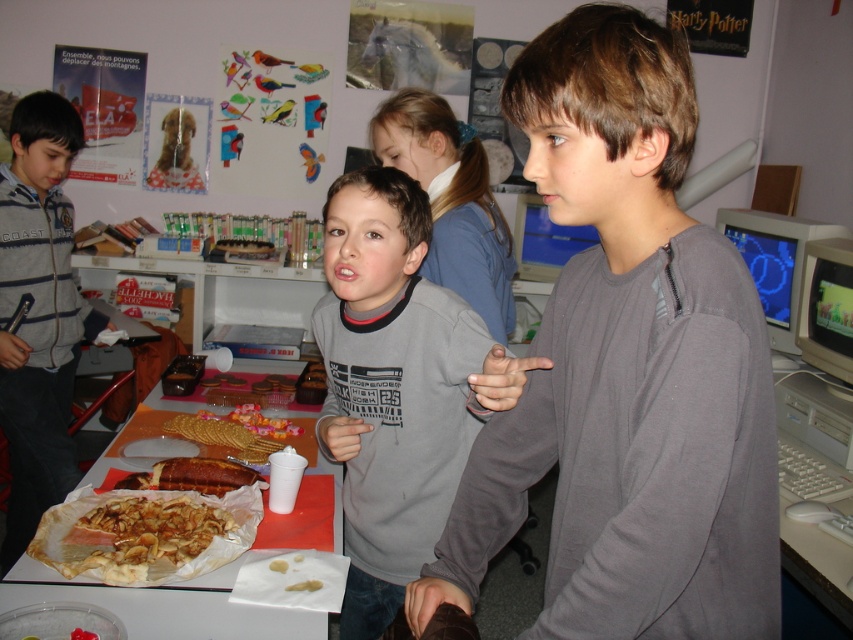
Is point (582, 493) behind point (160, 412)?

No, (582, 493) is in front of (160, 412).

Does gray zip-up sweatshirt at center have a greater height compared to white paper plate at center?

Yes, gray zip-up sweatshirt at center is taller than white paper plate at center.

Locate an element on the screen. Image resolution: width=853 pixels, height=640 pixels. gray zip-up sweatshirt at center is located at coordinates (627, 369).

In the scene shown: Does striped fleece jacket at left lie behind pink sugary cookies at center?

Yes, it is.

Who is positioned more to the left, striped fleece jacket at left or pink sugary cookies at center?

From the viewer's perspective, striped fleece jacket at left appears more on the left side.

Does point (27, 193) come closer to viewer compared to point (305, 440)?

No, it is not.

This screenshot has height=640, width=853. In order to click on striped fleece jacket at left in this screenshot , I will do `click(38, 312)`.

Who is positioned more to the left, gray zip-up sweatshirt at center or matte plastic tray at center?

matte plastic tray at center

Does gray zip-up sweatshirt at center come behind matte plastic tray at center?

That is False.

Is point (648, 520) closer to camera compared to point (254, 252)?

Yes, it is in front of point (254, 252).

The image size is (853, 640). What are the coordinates of `gray zip-up sweatshirt at center` in the screenshot? It's located at (627, 369).